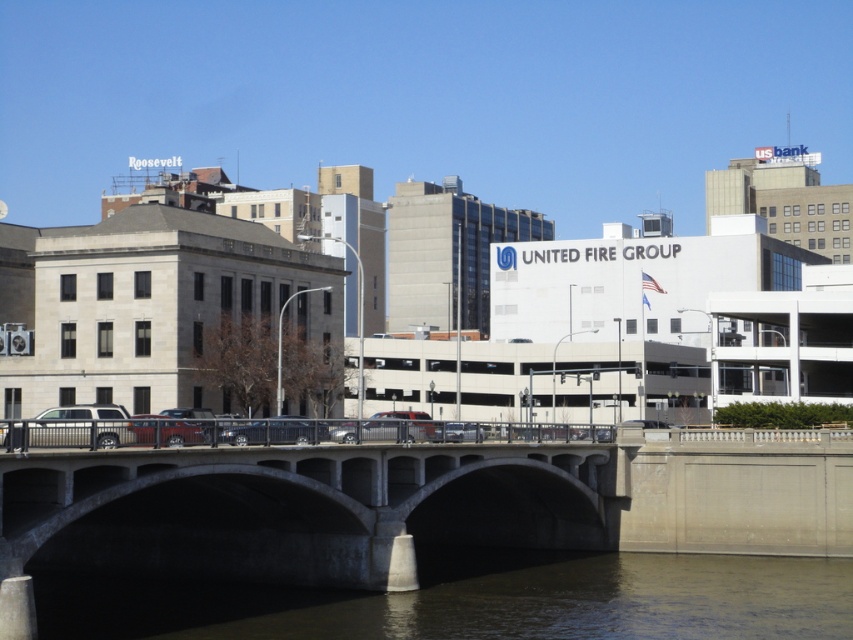
Question: Which point appears farthest from the camera in this image?

Choices:
 (A) (132, 609)
 (B) (259, 577)
 (C) (54, 440)

Answer: (B)

Question: Does brown concrete river at lower center have a greater width compared to silver metallic suv at center?

Choices:
 (A) yes
 (B) no

Answer: (A)

Question: Is concrete bridge at center further to the viewer compared to brown concrete river at lower center?

Choices:
 (A) no
 (B) yes

Answer: (A)

Question: Which object is the closest to the concrete bridge at center?

Choices:
 (A) brown concrete river at lower center
 (B) silver metallic suv at center

Answer: (A)

Question: Among these objects, which one is farthest from the camera?

Choices:
 (A) silver metallic suv at center
 (B) concrete bridge at center
 (C) brown concrete river at lower center

Answer: (C)

Question: Can you confirm if concrete bridge at center is positioned to the right of brown concrete river at lower center?

Choices:
 (A) no
 (B) yes

Answer: (A)